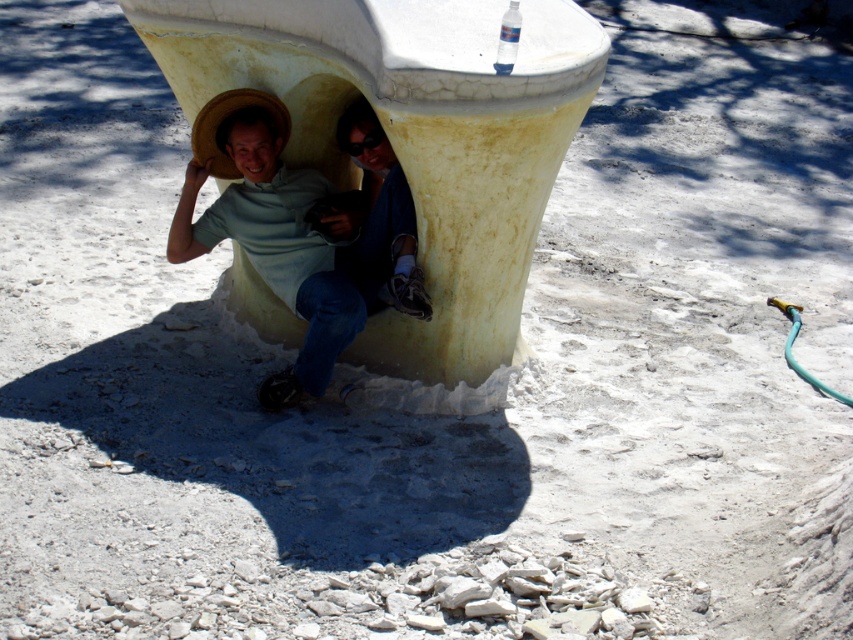
You are standing at the entrance of the giant seashell structure and want to place a small flag at the point closer to you between point (579, 92) and point (373, 269). Which point should you choose?

Point (579, 92) is closer to the camera, so you should place the flag there.

You are designing a new fashion collection and need to know the relative sizes of the items in the image. Which object is wider, the matte straw hat at center or the matte blue jeans at center?

The matte straw hat at center is wider than the matte blue jeans at center according to the description provided.

You are standing at the entrance of the giant seashell structure and want to locate the yellow cracked concrete pillar at center. According to the coordinates provided, where should you look to find it?

→ The yellow cracked concrete pillar at center is located at point coordinates of (415, 148).